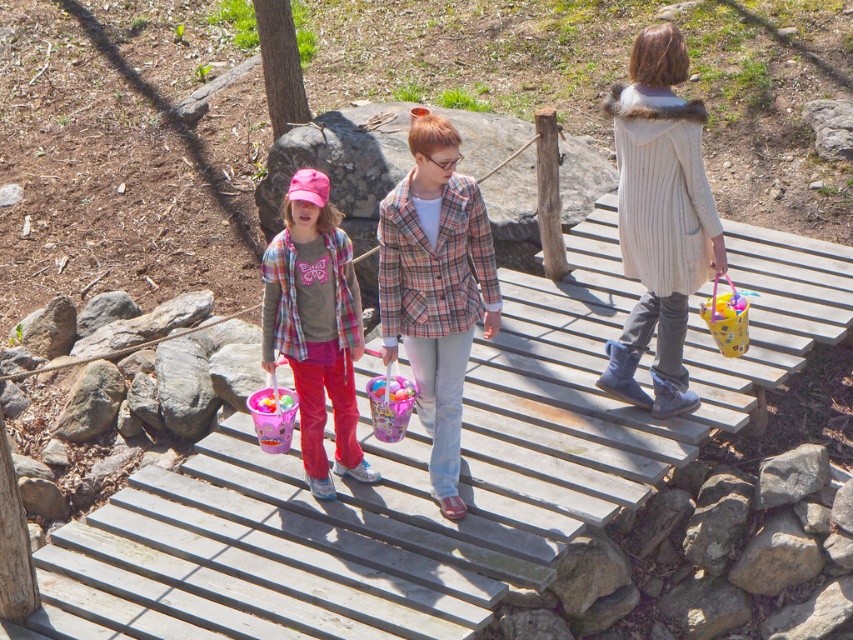
Question: Based on their relative distances, which object is nearer to the white knitted coat at center?

Choices:
 (A) plaid fabric jacket at center
 (B) plaid fabric shirt at center
 (C) translucent yellow bucket at center

Answer: (C)

Question: Is white knitted coat at center behind translucent yellow bucket at center?

Choices:
 (A) no
 (B) yes

Answer: (A)

Question: Among these objects, which one is nearest to the camera?

Choices:
 (A) white knitted coat at center
 (B) plaid fabric shirt at center

Answer: (B)

Question: Which of the following is the closest to the observer?

Choices:
 (A) plaid fabric jacket at center
 (B) translucent yellow bucket at center
 (C) white knitted coat at center

Answer: (A)

Question: Does plaid fabric jacket at center appear over plaid fabric shirt at center?

Choices:
 (A) no
 (B) yes

Answer: (B)

Question: Considering the relative positions of white knitted coat at center and translucent yellow bucket at center in the image provided, where is white knitted coat at center located with respect to translucent yellow bucket at center?

Choices:
 (A) right
 (B) left

Answer: (B)